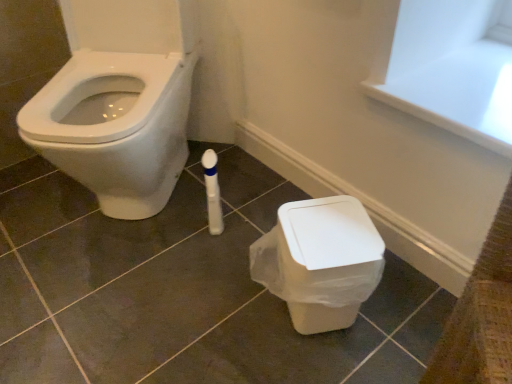
Identify the location of free space to the left of white plastic bin at lower right. The height and width of the screenshot is (384, 512). (214, 307).